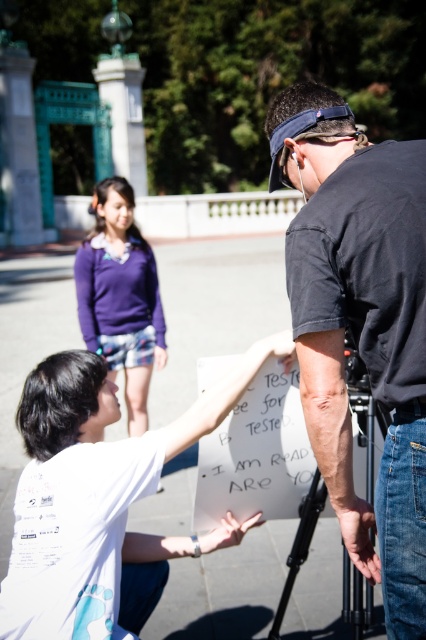
Question: Estimate the real-world distances between objects in this image. Which object is farther from the black matte shirt at center?

Choices:
 (A) purple fabric shorts at center
 (B) black matte tripod at lower center

Answer: (A)

Question: Does black matte shirt at center appear on the right side of black matte tripod at lower center?

Choices:
 (A) no
 (B) yes

Answer: (B)

Question: Which of these objects is positioned farthest from the black matte shirt at center?

Choices:
 (A) purple fabric shorts at center
 (B) black matte tripod at lower center

Answer: (A)

Question: Can you confirm if black matte shirt at center is positioned to the left of black matte tripod at lower center?

Choices:
 (A) yes
 (B) no

Answer: (B)

Question: Is purple fabric shorts at center below black matte tripod at lower center?

Choices:
 (A) no
 (B) yes

Answer: (A)

Question: Which object is closer to the camera taking this photo?

Choices:
 (A) purple fabric shorts at center
 (B) black matte shirt at center
 (C) black matte tripod at lower center

Answer: (B)